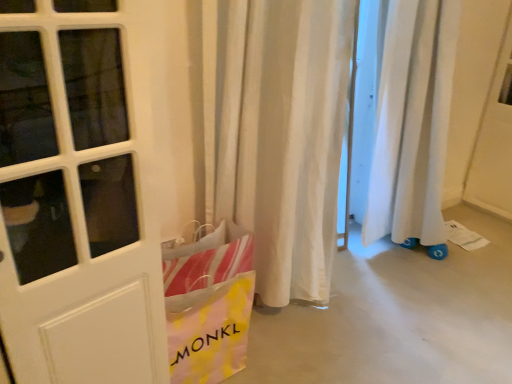
Find the location of a particular element. spots to the right of white fabric curtain at center is located at coordinates (375, 316).